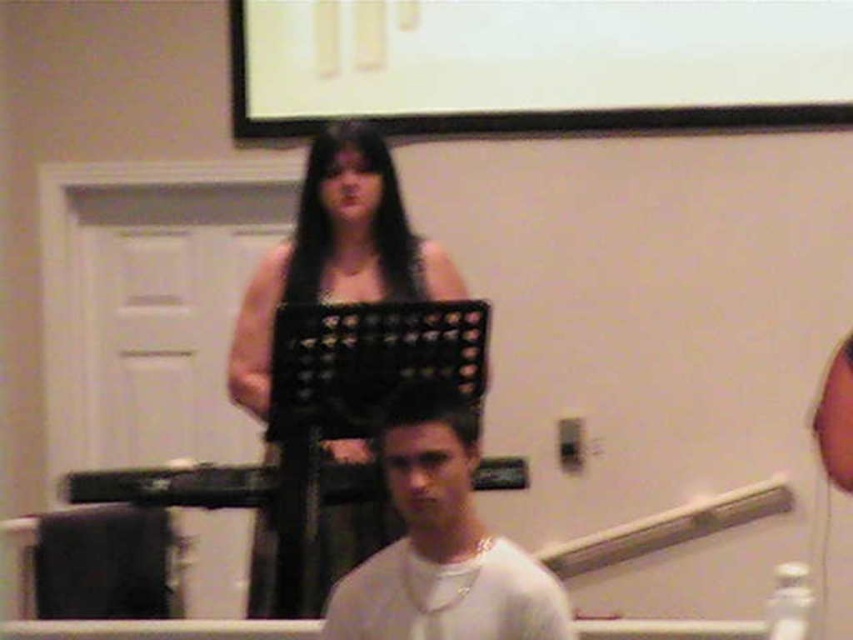
You are standing in the room shown in the image. The point at coordinates (x=335, y=252) is marked. What object is located at that point?

The point at coordinates (x=335, y=252) marks the black matte music stand at center.

You are an event organizer setting up a presentation room. You need to adjust the placement of the black matte music stand at center so that it is visible to the audience without blocking the white matte projection screen at upper center. Based on their current positions, is the music stand already positioned in a way that it doesn not obstruct the screen?

The black matte music stand at center is behind the white matte projection screen at upper center, so it is already positioned in a way that it does not obstruct the screen.